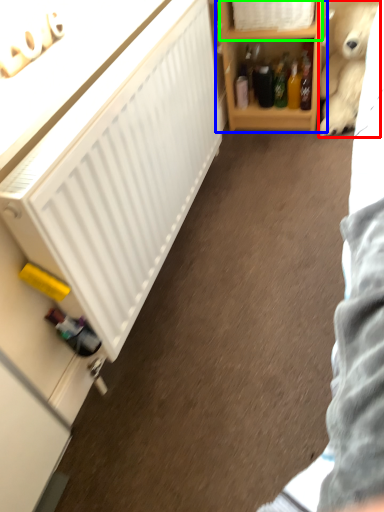
Question: Based on their relative distances, which object is farther from teddy bear (highlighted by a red box)? Choose from shelf (highlighted by a blue box) and cabinet (highlighted by a green box).

Choices:
 (A) shelf
 (B) cabinet

Answer: (B)